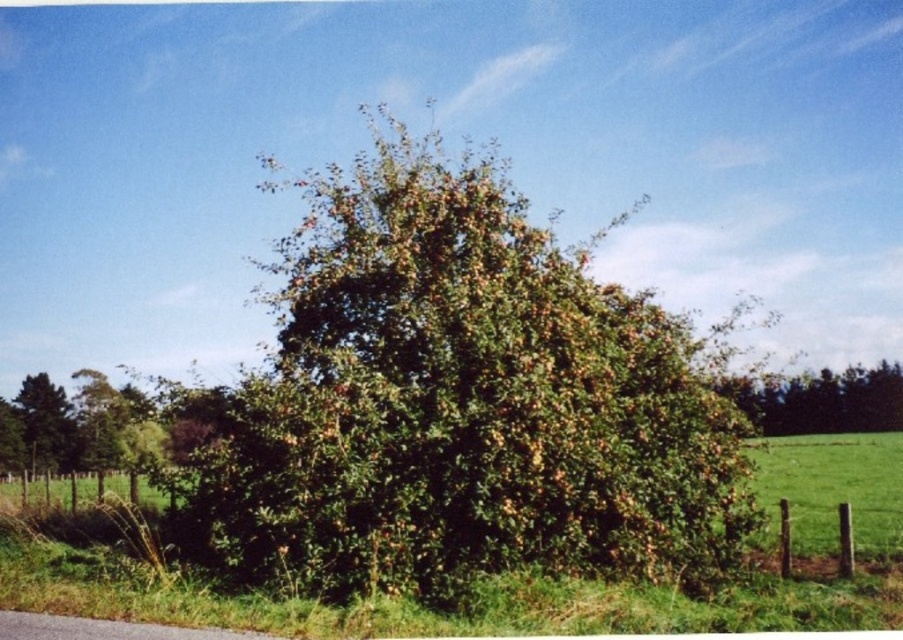
Is green leafy bush at center wider than green leafy tree at left?

Correct, the width of green leafy bush at center exceeds that of green leafy tree at left.

Image resolution: width=903 pixels, height=640 pixels. I want to click on green leafy bush at center, so click(x=462, y=404).

Does green leafy bush at right appear under green leafy tree at left?

No, green leafy bush at right is not below green leafy tree at left.

Which is more to the right, green leafy bush at right or green leafy tree at left?

green leafy bush at right is more to the right.

Is point (878, 397) farther from camera compared to point (59, 417)?

Yes, point (878, 397) is behind point (59, 417).

You are a GUI agent. You are given a task and a screenshot of the screen. Output one action in this format:
    pyautogui.click(x=<x>, y=<y>)
    Task: Click on the green leafy bush at right
    Image resolution: width=903 pixels, height=640 pixels.
    Given the screenshot: What is the action you would take?
    pyautogui.click(x=821, y=401)

Between green leafy bush at center and green leafy bush at right, which one is positioned lower?

green leafy bush at right

Does green leafy bush at center have a greater width compared to green leafy bush at right?

In fact, green leafy bush at center might be narrower than green leafy bush at right.

Locate an element on the screen. The width and height of the screenshot is (903, 640). green leafy bush at center is located at coordinates (462, 404).

Where is `green leafy bush at center`? green leafy bush at center is located at coordinates (462, 404).